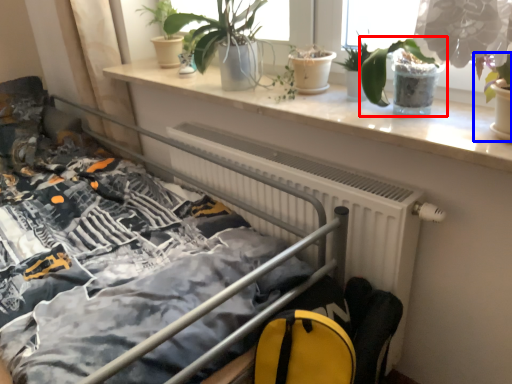
Question: Which object is closer to the camera taking this photo, houseplant (highlighted by a red box) or houseplant (highlighted by a blue box)?

Choices:
 (A) houseplant
 (B) houseplant

Answer: (B)